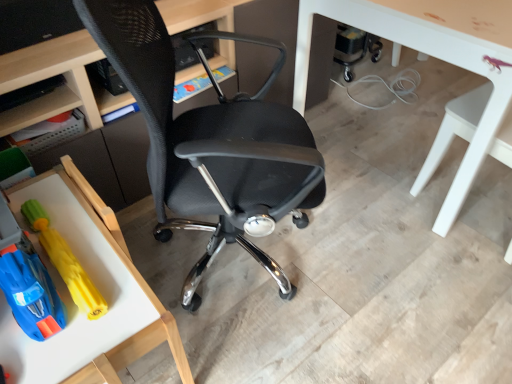
The image size is (512, 384). I want to click on vacant space to the right of black mesh chair at center, which is the second chair from right to left, so click(x=382, y=266).